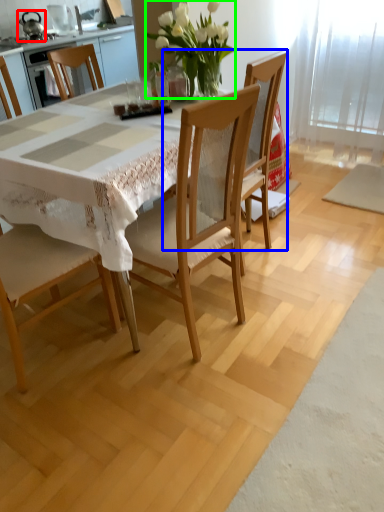
Question: Which object is the closest to the appliance (highlighted by a red box)? Choose among these: chair (highlighted by a blue box) or floral arrangement (highlighted by a green box).

Choices:
 (A) chair
 (B) floral arrangement

Answer: (B)